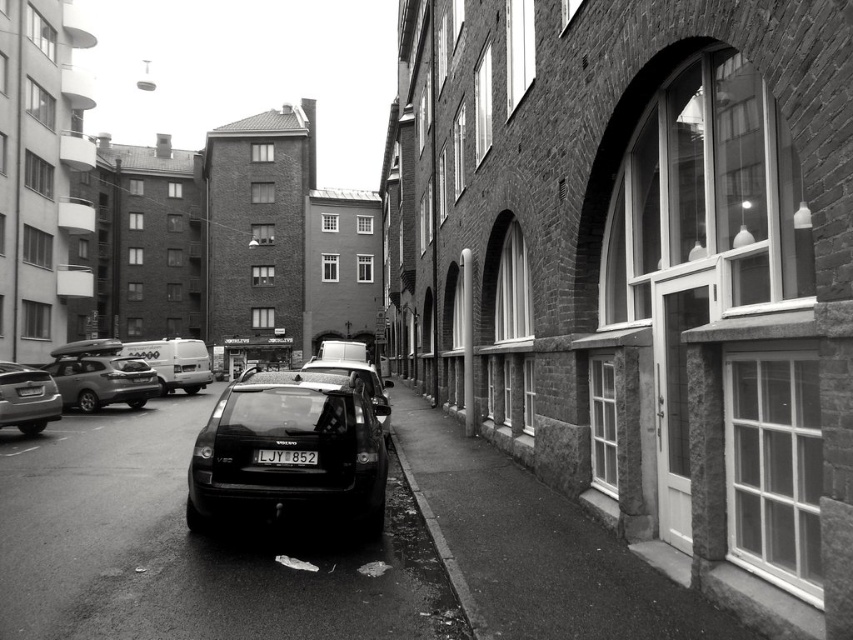
You are a pedestrian standing at the edge of the smooth asphalt curb at lower center. You want to cross the street to the door with a glass panel near the bottom right corner. Is the matte black suv at left blocking your path?

The matte black suv at left is located above the smooth asphalt curb at lower center, so it is positioned higher up in the scene. Since you are standing at the curb, the suv is not directly in front of you but rather further along the street. Therefore, it is likely not blocking your path to the door with the glass panel.